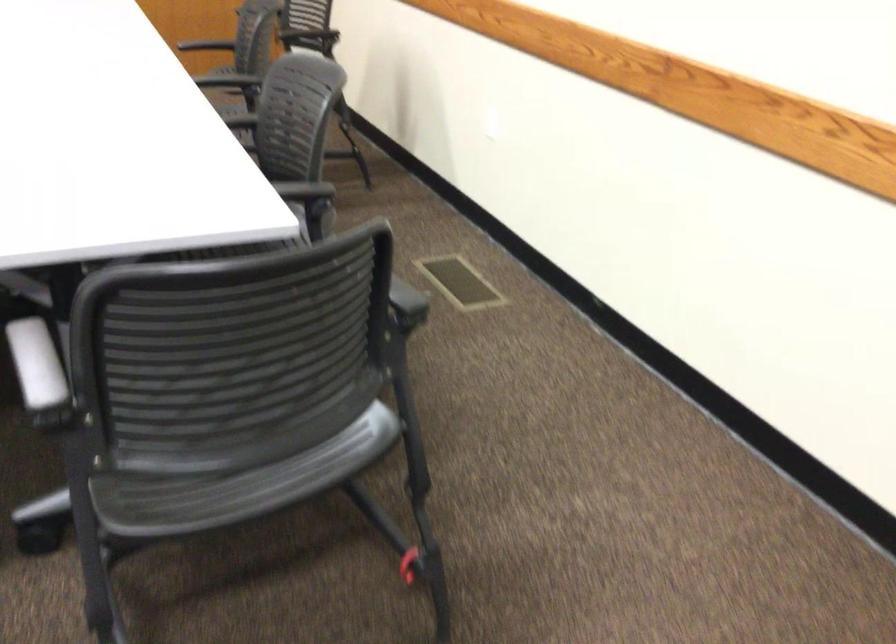
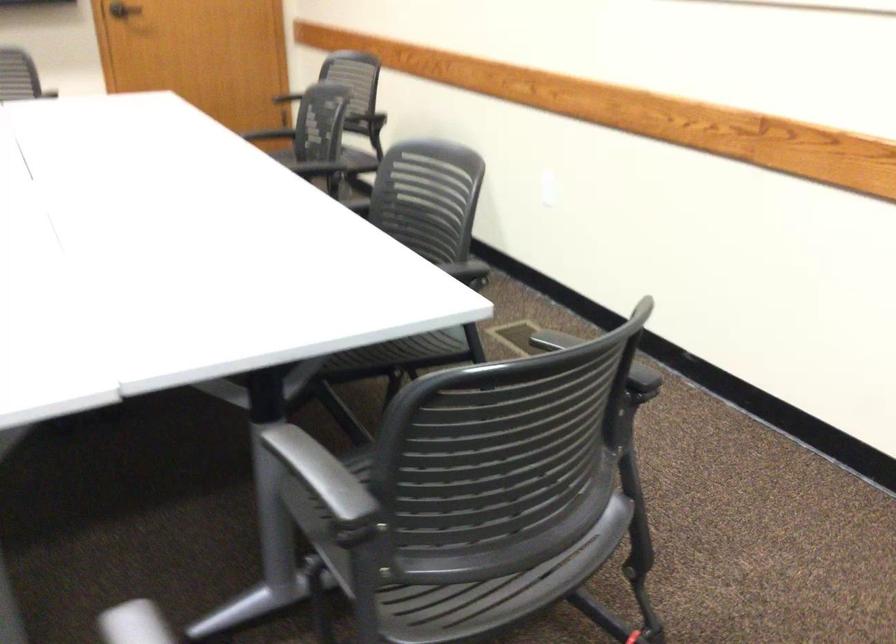
In the second image, find the point that corresponds to (320,272) in the first image.

(598, 359)